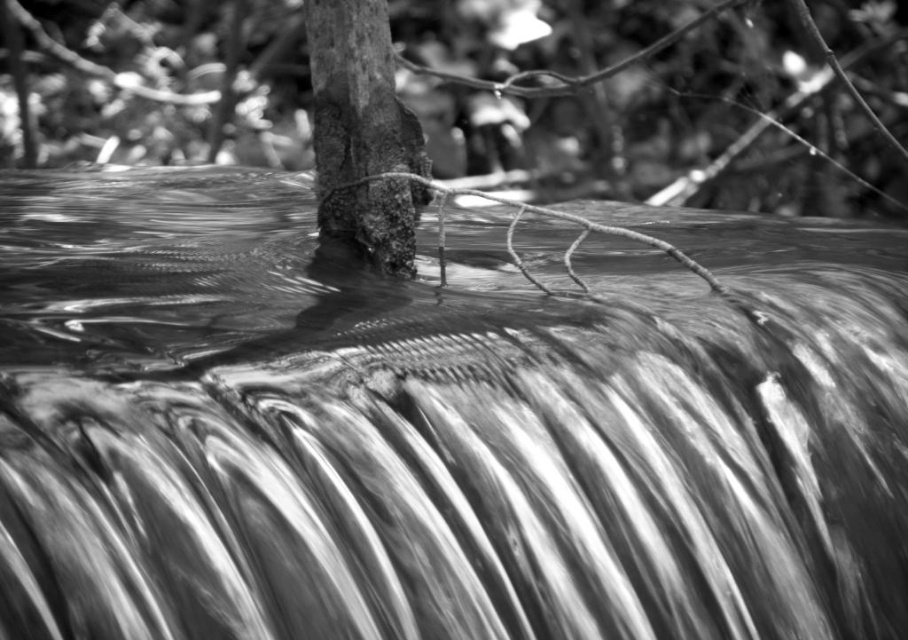
Question: Is smooth water at center thinner than rough bark tree trunk at center?

Choices:
 (A) no
 (B) yes

Answer: (A)

Question: Is smooth water at center positioned behind rough bark tree trunk at center?

Choices:
 (A) no
 (B) yes

Answer: (A)

Question: Which point is farther from the camera taking this photo?

Choices:
 (A) (314, 3)
 (B) (638, 556)

Answer: (A)

Question: Can you confirm if smooth water at center is wider than rough bark tree trunk at center?

Choices:
 (A) yes
 (B) no

Answer: (A)

Question: Which point appears closest to the camera in this image?

Choices:
 (A) (385, 29)
 (B) (538, 292)

Answer: (B)